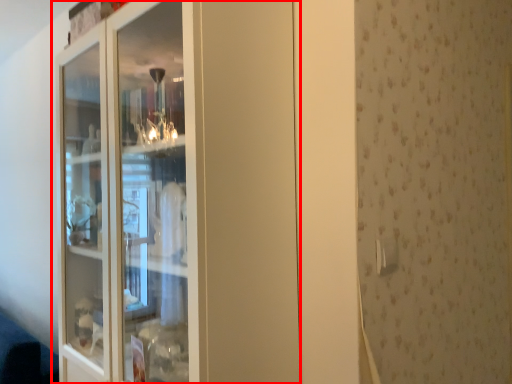
Question: From the image's perspective, considering the relative positions of cupboard (annotated by the red box) and door handle in the image provided, where is cupboard (annotated by the red box) located with respect to the staircase?

Choices:
 (A) above
 (B) below

Answer: (A)